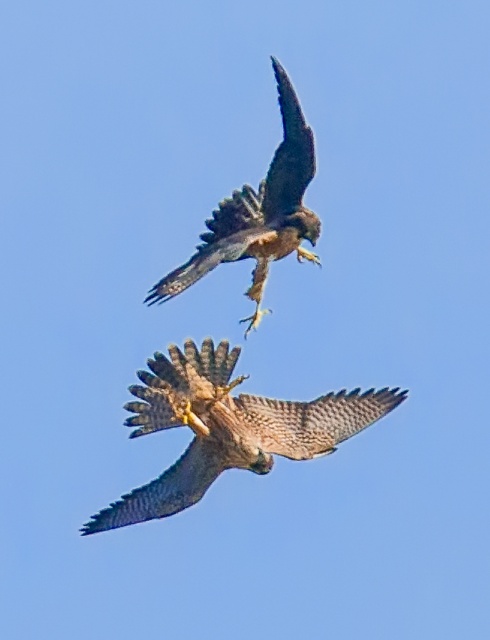
Question: Which point is closer to the camera taking this photo?

Choices:
 (A) (321, 449)
 (B) (216, 243)

Answer: (B)

Question: Is brown speckled feathers at center behind brown feathered eagle at upper center?

Choices:
 (A) yes
 (B) no

Answer: (A)

Question: Which point is farther to the camera?

Choices:
 (A) (235, 436)
 (B) (220, 212)

Answer: (B)

Question: Is brown speckled feathers at center further to the viewer compared to brown feathered eagle at upper center?

Choices:
 (A) yes
 (B) no

Answer: (A)

Question: Does brown speckled feathers at center appear under brown feathered eagle at upper center?

Choices:
 (A) yes
 (B) no

Answer: (A)